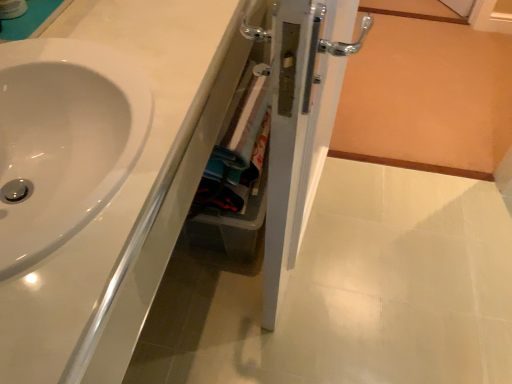
Measure the distance between white glossy sink at upper left and camera.

A distance of 18.82 inches exists between white glossy sink at upper left and camera.

Find the location of a particular element. white glossy sink at upper left is located at coordinates (96, 176).

The width and height of the screenshot is (512, 384). Describe the element at coordinates (96, 176) in the screenshot. I see `white glossy sink at upper left` at that location.

Locate an element on the screen. white glossy sink at upper left is located at coordinates (96, 176).